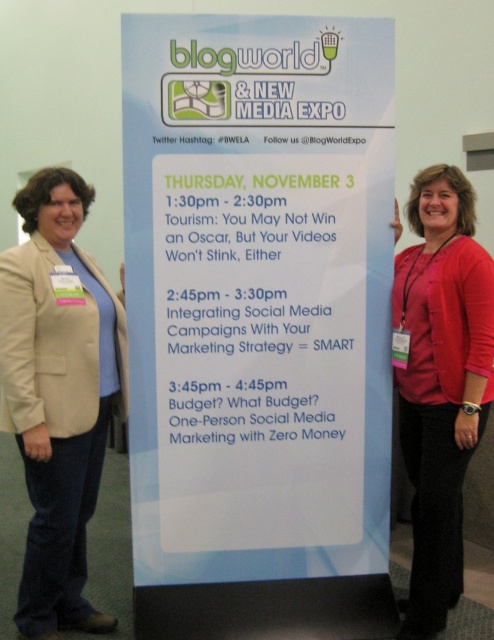
You are a conference attendee holding a beige fabric blazer at left and a white paper sign at center. You want to display both items on a table so that the smaller one is on the right side. Which item should you place on the right?

The beige fabric blazer at left is smaller than the white paper sign at center, so you should place the beige fabric blazer at left on the right side.

You are attending Blogworld and need to present your work. You see a beige fabric blazer at left and a red matte shirt at center. Which clothing item is closer to the top of the banner?

The beige fabric blazer at left is positioned under the red matte shirt at center, so the red matte shirt at center is closer to the top of the banner.

You are a photographer at the Blogworld event. You want to take a photo of the white paper sign at center and the red matte shirt at center so that both are in focus. The camera you are using has a depth of field that can cover 16 inches. Will both objects be in focus in the photo?

The white paper sign at center and red matte shirt at center are 16.57 inches apart. Since the camera can only cover 16 inches, the distance between them exceeds the depth of field. Therefore, both objects might not be in focus simultaneously.